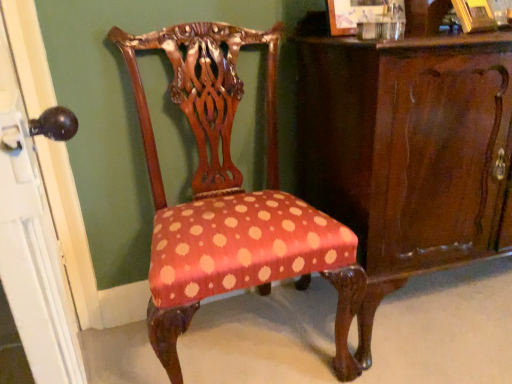
Question: From a real-world perspective, is matte black knob at left physically above polka dot fabric chair at center?

Choices:
 (A) no
 (B) yes

Answer: (B)

Question: Is matte black knob at left oriented towards polka dot fabric chair at center?

Choices:
 (A) no
 (B) yes

Answer: (B)

Question: From the image's perspective, does matte black knob at left appear higher than polka dot fabric chair at center?

Choices:
 (A) yes
 (B) no

Answer: (B)

Question: Is matte black knob at left positioned in front of polka dot fabric chair at center?

Choices:
 (A) no
 (B) yes

Answer: (B)

Question: Does matte black knob at left appear on the right side of polka dot fabric chair at center?

Choices:
 (A) no
 (B) yes

Answer: (A)

Question: Does matte black knob at left touch polka dot fabric chair at center?

Choices:
 (A) yes
 (B) no

Answer: (B)

Question: Is shiny dark wood vanity at center to the left of matte black knob at left from the viewer's perspective?

Choices:
 (A) yes
 (B) no

Answer: (B)

Question: From the image's perspective, does shiny dark wood vanity at center appear higher than matte black knob at left?

Choices:
 (A) yes
 (B) no

Answer: (A)

Question: Is shiny dark wood vanity at center positioned with its back to matte black knob at left?

Choices:
 (A) yes
 (B) no

Answer: (B)

Question: Considering the relative sizes of shiny dark wood vanity at center and matte black knob at left in the image provided, is shiny dark wood vanity at center thinner than matte black knob at left?

Choices:
 (A) yes
 (B) no

Answer: (B)

Question: Can you confirm if shiny dark wood vanity at center is taller than matte black knob at left?

Choices:
 (A) yes
 (B) no

Answer: (B)

Question: Considering the relative positions of shiny dark wood vanity at center and matte black knob at left in the image provided, is shiny dark wood vanity at center in front of matte black knob at left?

Choices:
 (A) no
 (B) yes

Answer: (A)

Question: Is polka dot fabric chair at center closer to the viewer compared to shiny dark wood vanity at center?

Choices:
 (A) no
 (B) yes

Answer: (B)